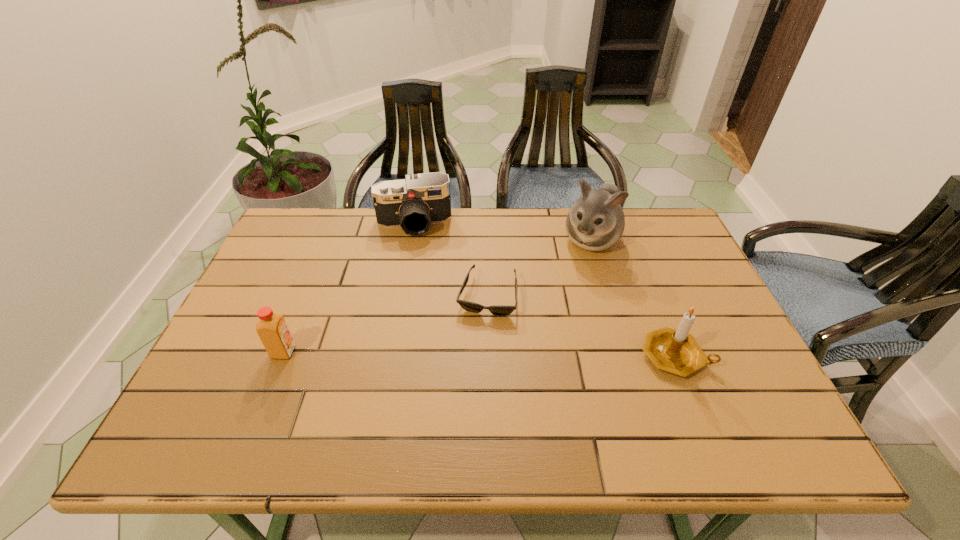
Image resolution: width=960 pixels, height=540 pixels. I want to click on empty space between the third object from right to left and the candle holder, so click(x=581, y=326).

Find the location of a particular element. The width and height of the screenshot is (960, 540). free area in between the leftmost object and the tallest object is located at coordinates (437, 296).

You are a GUI agent. You are given a task and a screenshot of the screen. Output one action in this format:
    pyautogui.click(x=<x>, y=<y>)
    Task: Click on the vacant region between the candle holder and the camera
    
    Given the screenshot: What is the action you would take?
    pyautogui.click(x=544, y=290)

This screenshot has width=960, height=540. Identify the location of vacant point located between the candle holder and the hamster. (633, 298).

Image resolution: width=960 pixels, height=540 pixels. Find the location of `free space between the candle holder and the sunglasses`. free space between the candle holder and the sunglasses is located at coordinates (581, 326).

Where is `free spot between the tallest object and the second object from left to right`? The image size is (960, 540). free spot between the tallest object and the second object from left to right is located at coordinates (502, 232).

This screenshot has height=540, width=960. What are the coordinates of `empty space between the tallest object and the orange juice` in the screenshot? It's located at (437, 296).

Find the location of a particular element. The image size is (960, 540). vacant area that lies between the tallest object and the third object from left to right is located at coordinates (540, 267).

What are the coordinates of `object identified as the third closest to the camera` in the screenshot? It's located at (272, 329).

Identify the location of object that is the third closest to the hamster. (414, 203).